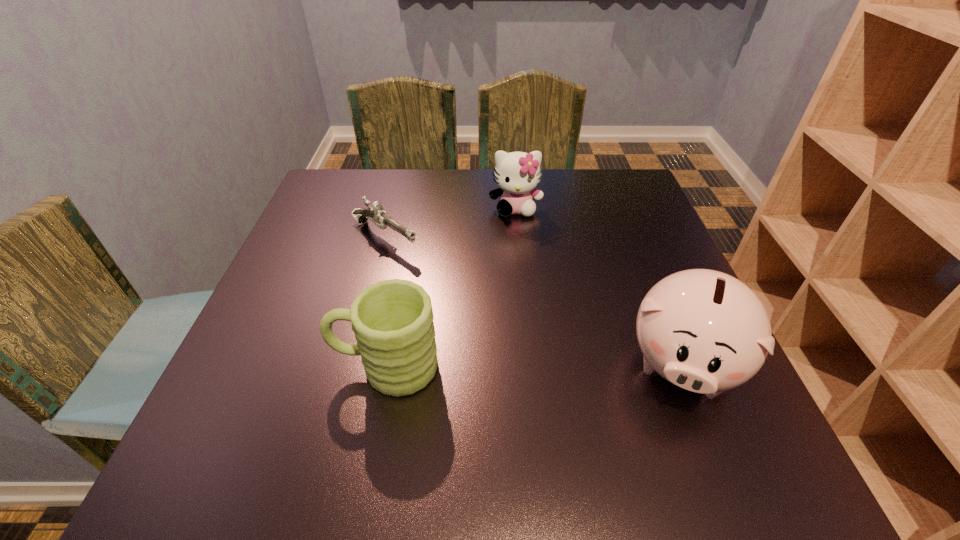
Identify the location of empty space between the mug and the tallest object. (534, 366).

What are the coordinates of `empty space that is in between the shortest object and the rightmost object` in the screenshot? It's located at (533, 301).

Where is `free space between the mug and the kitten`? This screenshot has width=960, height=540. free space between the mug and the kitten is located at coordinates (451, 287).

I want to click on object that stands as the third closest to the tallest object, so click(x=375, y=213).

Find the location of a particular element. object that is the third closest one to the tallest object is located at coordinates (375, 213).

Locate an element on the screen. Image resolution: width=960 pixels, height=540 pixels. free region that satisfies the following two spatial constraints: 1. on the front side of the piggy bank; 2. on the left side of the shortest object is located at coordinates (351, 365).